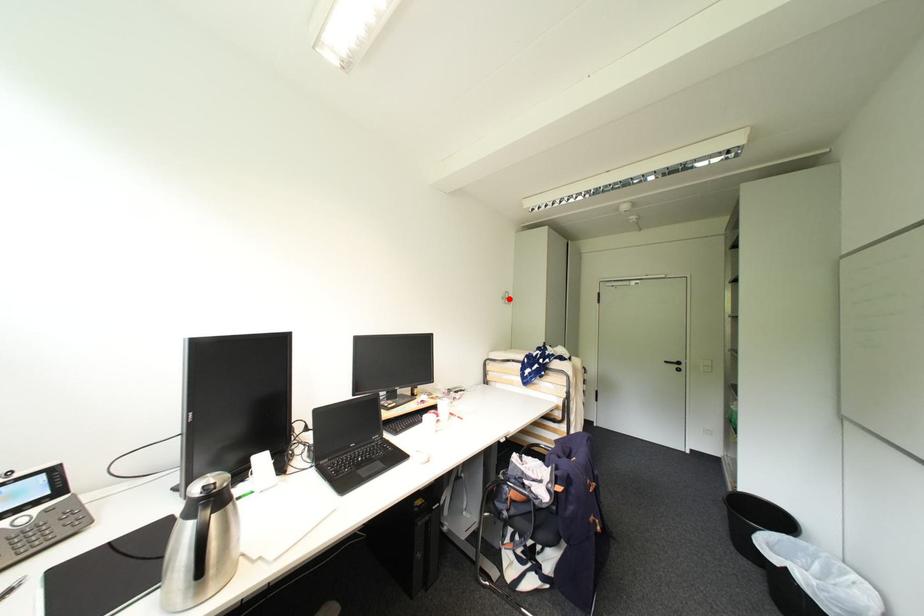
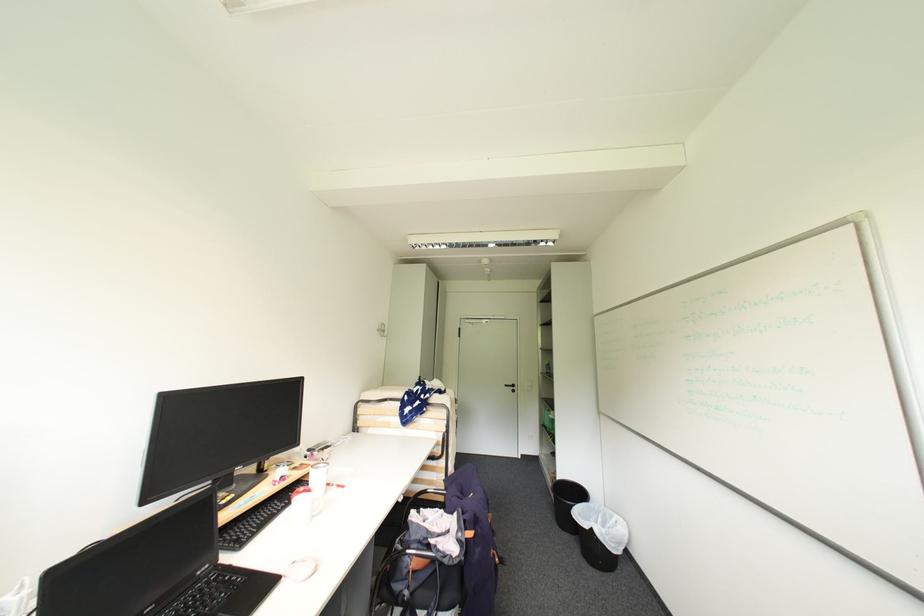
Locate, in the second image, the point that corresponds to the highlighted location in the first image.

(384, 331)